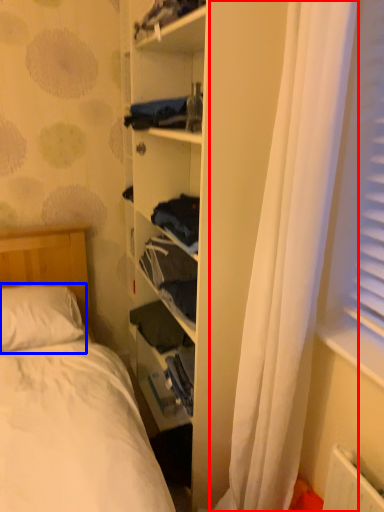
Question: Which point is closer to the camera, curtain (highlighted by a red box) or pillow (highlighted by a blue box)?

Choices:
 (A) curtain
 (B) pillow

Answer: (A)